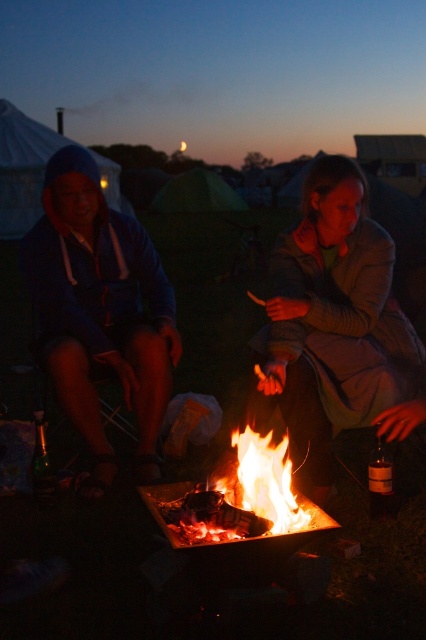
Question: Which object is positioned farthest from the blue fleece jacket at left?

Choices:
 (A) flaming wood at center
 (B) matte gray jacket at center

Answer: (A)

Question: Is matte gray jacket at center above flaming wood at center?

Choices:
 (A) no
 (B) yes

Answer: (B)

Question: Does matte gray jacket at center appear over flaming wood at center?

Choices:
 (A) yes
 (B) no

Answer: (A)

Question: Based on their relative distances, which object is farther from the matte gray jacket at center?

Choices:
 (A) flaming wood at center
 (B) blue fleece jacket at left

Answer: (B)

Question: Which of the following is the farthest from the observer?

Choices:
 (A) (129, 346)
 (B) (325, 257)

Answer: (A)

Question: Observing the image, what is the correct spatial positioning of matte gray jacket at center in reference to blue fleece jacket at left?

Choices:
 (A) right
 (B) left

Answer: (A)